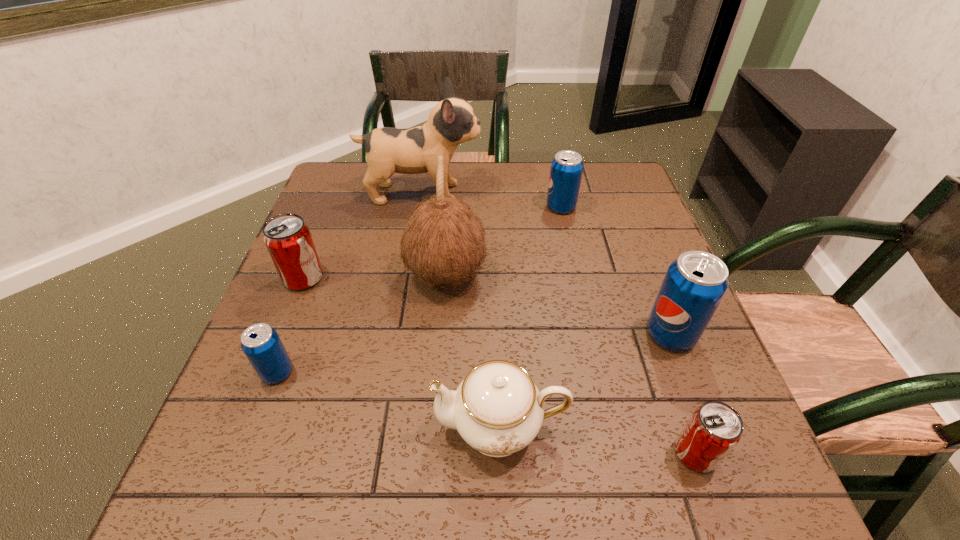
Locate which blue pop soda is the closest to the smallest blue pop soda. Please provide its 2D coordinates. Your answer should be formatted as a tuple, i.e. [(x, y)], where the tuple contains the x and y coordinates of a point satisfying the conditions above.

[(694, 285)]

This screenshot has width=960, height=540. Identify the location of vacant space that satisfies the following two spatial constraints: 1. on the back side of the left red pop soda; 2. on the left side of the second smallest blue pop soda. point(332,207).

I want to click on vacant space that satisfies the following two spatial constraints: 1. on the front side of the nearer red pop soda; 2. on the right side of the nearest blue pop soda, so click(247, 453).

At what (x,y) coordinates should I click in order to perform the action: click on vacant area that satisfies the following two spatial constraints: 1. at the face of the puppy; 2. on the front side of the bigger red pop soda. Please return your answer as a coordinate pair (x, y). Looking at the image, I should click on (407, 278).

Where is `vacant area in the image that satisfies the following two spatial constraints: 1. on the back side of the third pop soda from right to left; 2. at the face of the puppy`? This screenshot has height=540, width=960. vacant area in the image that satisfies the following two spatial constraints: 1. on the back side of the third pop soda from right to left; 2. at the face of the puppy is located at coordinates (558, 193).